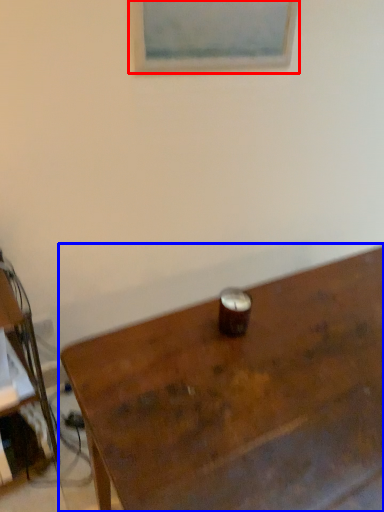
Question: Which object appears closest to the camera in this image, picture frame (highlighted by a red box) or table (highlighted by a blue box)?

Choices:
 (A) picture frame
 (B) table

Answer: (B)